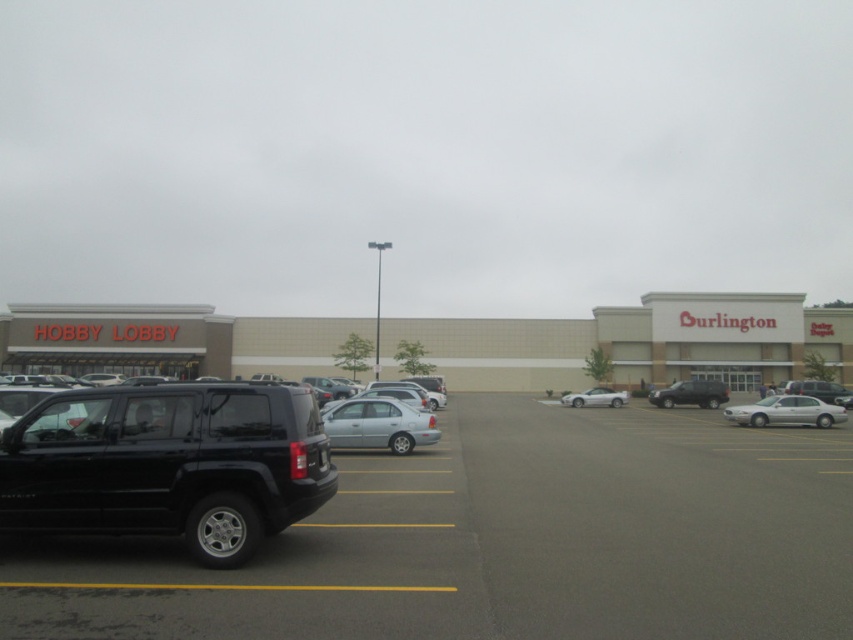
You are standing at the point marked by the coordinates (633, 342) in the parking lot between Hobby Lobby and Burlington. Which direction should you walk to reach the beige light brown building located at the center of the image?

The point at coordinates (633, 342) is already at the beige light brown building at center, so you are already there.

You are a delivery driver who needs to park your truck between the white glossy sedan at right and the matte black suv at right in the parking lot. Considering the height of both vehicles, which one should you position your truck closer to for easier access to the trunk?

The white glossy sedan at right is taller than the matte black suv at right. To ensure easier access to the truck trunk, you should position closer to the taller vehicle, the white glossy sedan at right, as it provides more clearance space above it.